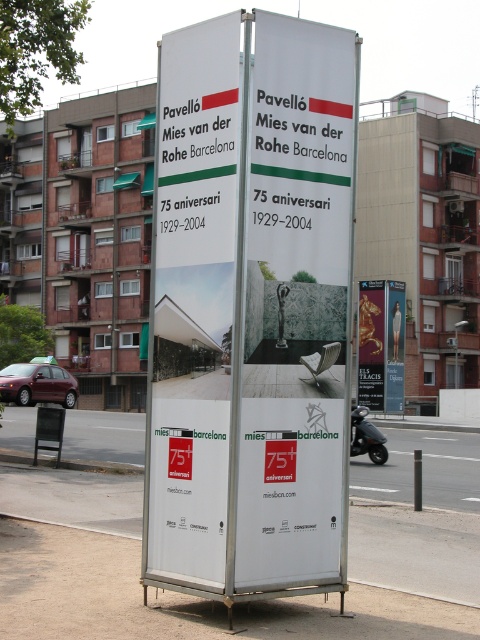
Can you confirm if white paper billboard at center is smaller than gold metallic statue at center?

Indeed, white paper billboard at center has a smaller size compared to gold metallic statue at center.

Who is higher up, white paper billboard at center or gold metallic statue at center?

Positioned higher is white paper billboard at center.

Is point (178, 499) in front of point (374, 348)?

Yes.

Locate an element on the screen. white paper billboard at center is located at coordinates (251, 308).

Can you confirm if gold metallic statue at center is thinner than metallic bus stop at lower left?

In fact, gold metallic statue at center might be wider than metallic bus stop at lower left.

Which of these two, gold metallic statue at center or metallic bus stop at lower left, stands shorter?

Standing shorter between the two is metallic bus stop at lower left.

Image resolution: width=480 pixels, height=640 pixels. What are the coordinates of `gold metallic statue at center` in the screenshot? It's located at (381, 344).

Between point (160, 317) and point (52, 413), which one is positioned in front?

Point (160, 317) is more forward.

Find the location of a particular element. Image resolution: width=480 pixels, height=640 pixels. white paper billboard at center is located at coordinates (251, 308).

Does point (228, 452) come farther from viewer compared to point (59, 419)?

No, it is not.

Find the location of `white paper billboard at center`. white paper billboard at center is located at coordinates (251, 308).